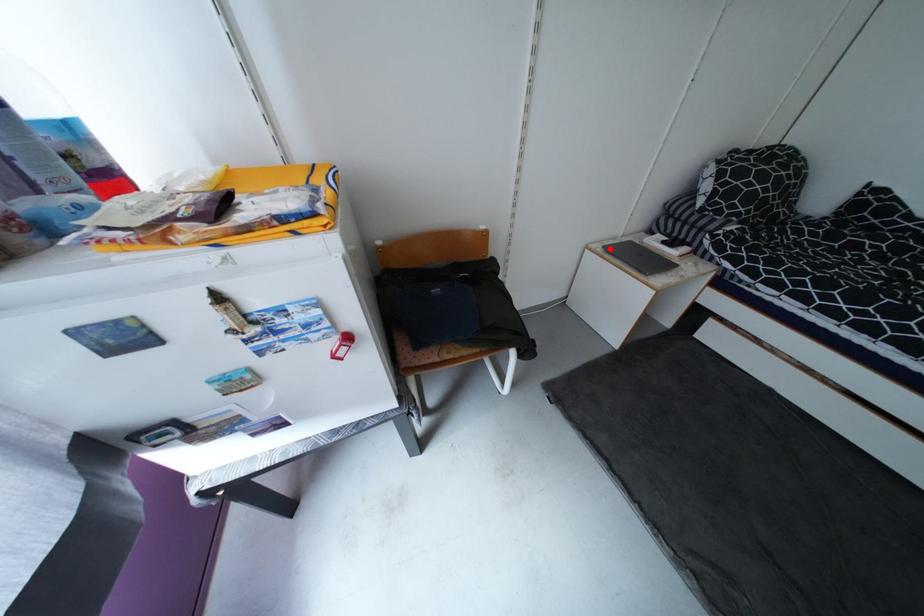
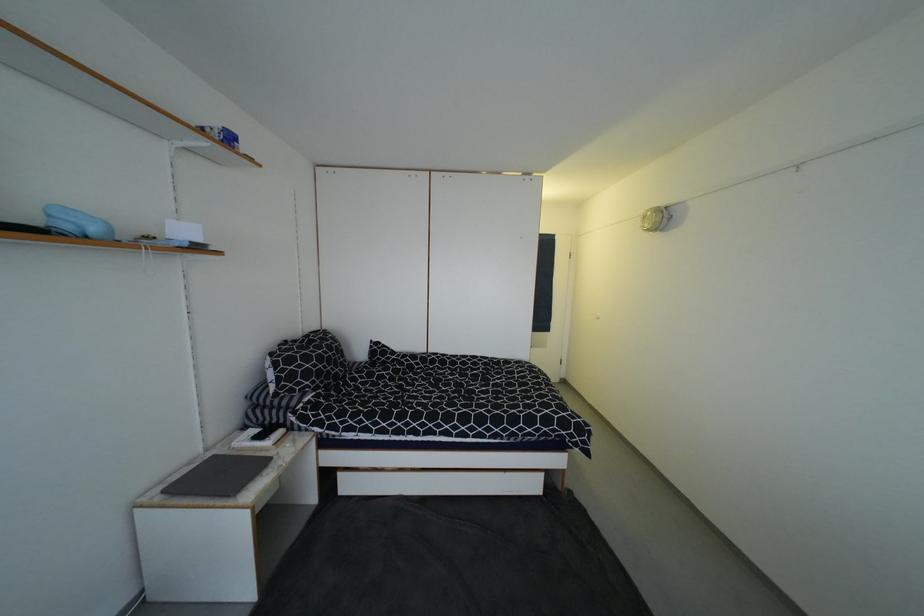
In the second image, find the point that corresponds to the highlighted location in the first image.

(169, 493)